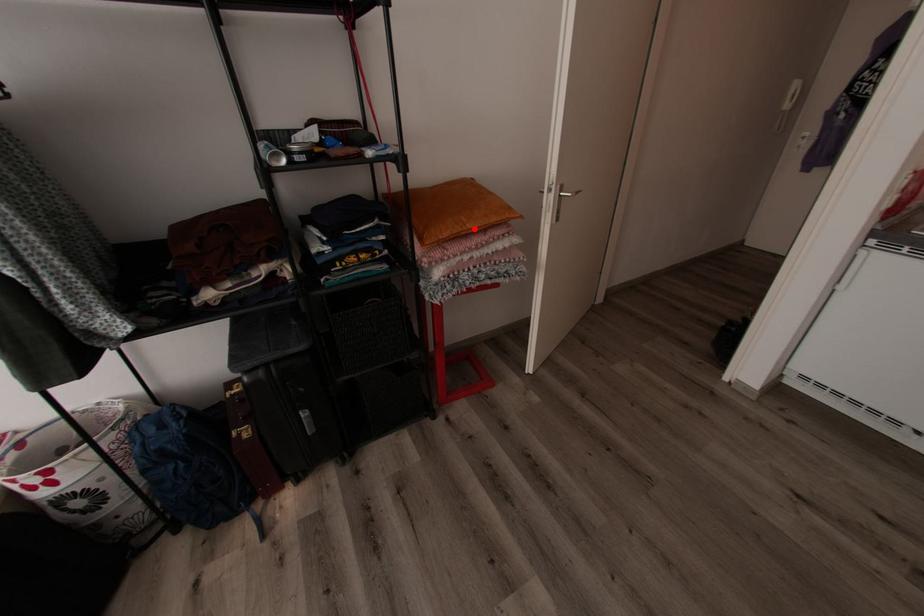
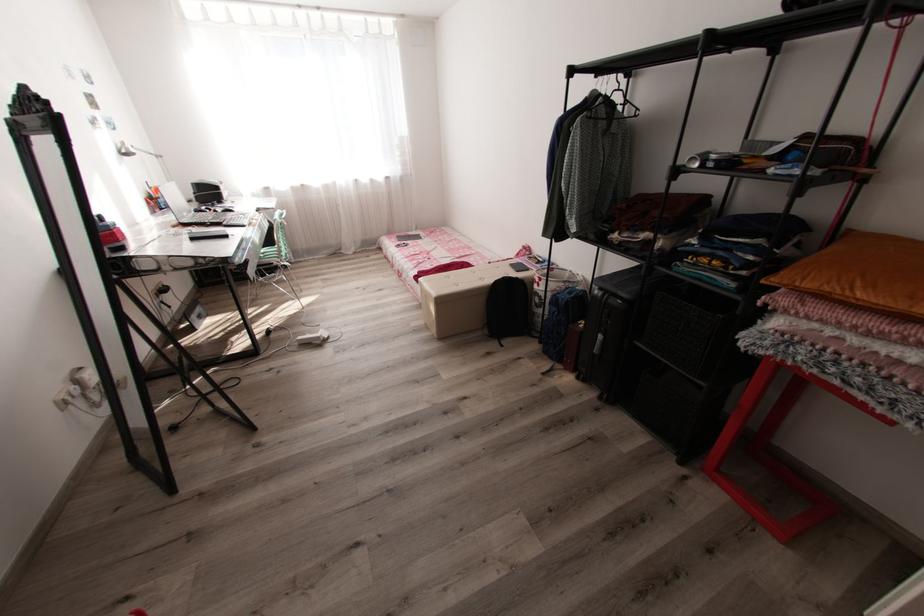
The point at the highlighted location is marked in the first image. Where is the corresponding point in the second image?

(861, 299)